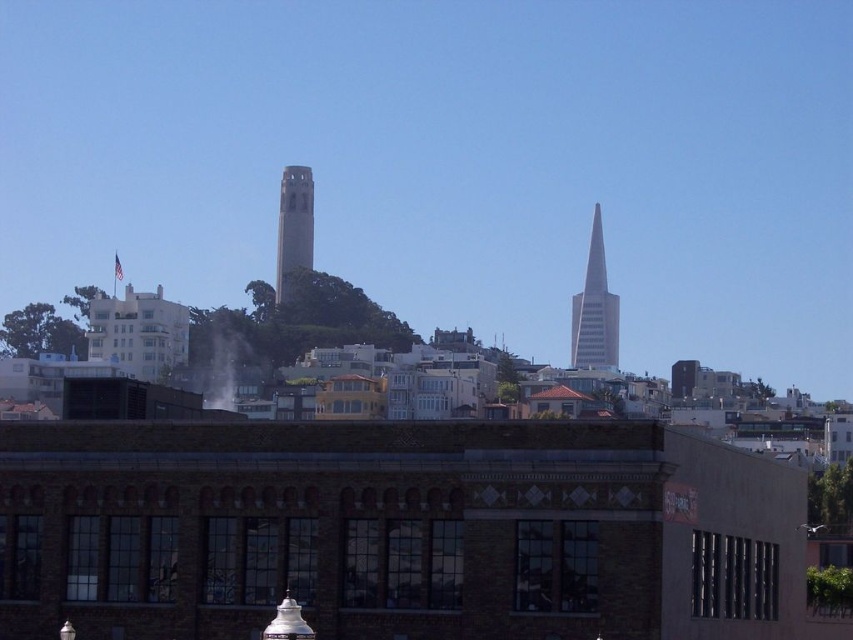
Question: Does silver glass spire at center right lie behind concrete tower at center?

Choices:
 (A) no
 (B) yes

Answer: (A)

Question: Is silver glass spire at center right above concrete tower at center?

Choices:
 (A) no
 (B) yes

Answer: (A)

Question: Is silver glass spire at center right closer to the viewer compared to concrete tower at center?

Choices:
 (A) no
 (B) yes

Answer: (B)

Question: Among these objects, which one is farthest from the camera?

Choices:
 (A) concrete tower at center
 (B) silver glass spire at center right

Answer: (A)

Question: Among these points, which one is farthest from the camera?

Choices:
 (A) (309, 177)
 (B) (573, 321)

Answer: (B)